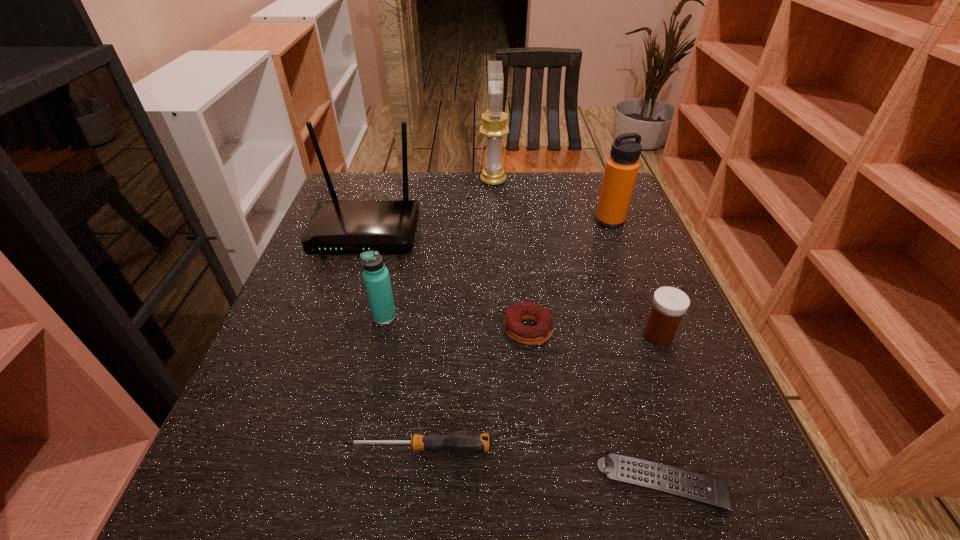
I want to click on vacant space located 0.070m on the back of the shortest object, so click(641, 416).

This screenshot has width=960, height=540. I want to click on award at the far edge, so click(494, 127).

The width and height of the screenshot is (960, 540). What are the coordinates of `router located at the far edge` in the screenshot? It's located at (337, 227).

Where is `thermos bottle located at the far edge`? thermos bottle located at the far edge is located at coordinates (621, 169).

At what (x,y) coordinates should I click in order to perform the action: click on object at the near edge. Please return your answer as a coordinate pair (x, y). Looking at the image, I should click on (692, 486).

The width and height of the screenshot is (960, 540). I want to click on object situated at the left edge, so click(x=337, y=227).

Where is `thermos bottle that is at the right edge`? thermos bottle that is at the right edge is located at coordinates (621, 169).

The width and height of the screenshot is (960, 540). Identify the location of medicine positioned at the right edge. (669, 304).

Find the location of a particular element. This screenshot has height=540, width=960. remote control that is positioned at the right edge is located at coordinates (692, 486).

Locate an element on the screen. object that is at the far left corner is located at coordinates (337, 227).